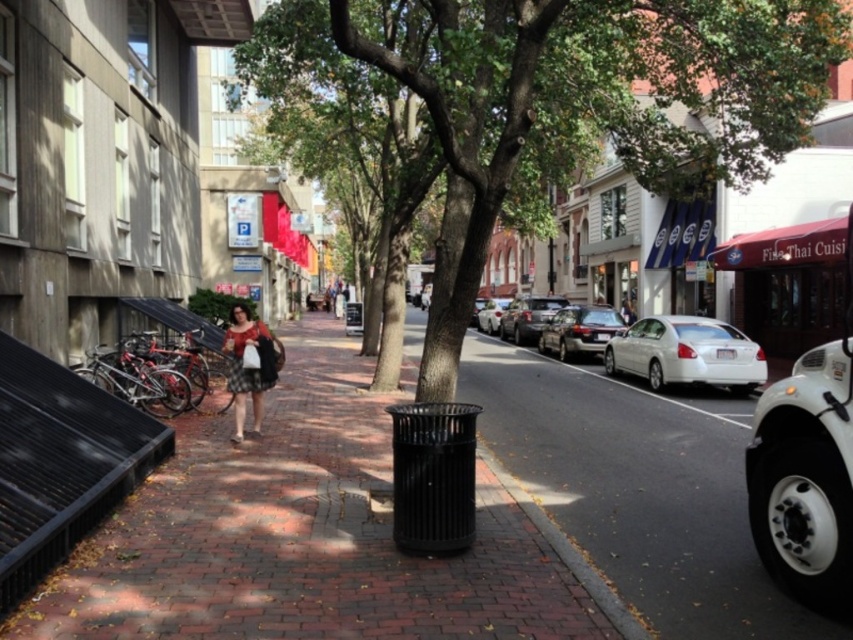
Question: Does green leafy tree at center appear on the right side of white glossy sedan at center-right?

Choices:
 (A) no
 (B) yes

Answer: (A)

Question: Does green leafy tree at center appear under shiny black sedan at center?

Choices:
 (A) no
 (B) yes

Answer: (A)

Question: Does black metal trash can at center appear on the left side of green leafy tree at center?

Choices:
 (A) yes
 (B) no

Answer: (A)

Question: Which point is farther to the camera?

Choices:
 (A) white glossy sedan at center-right
 (B) shiny black sedan at center
 (C) black metal trash can at center
 (D) white matte car at center

Answer: (D)

Question: Which object is positioned farthest from the shiny black sedan at center?

Choices:
 (A) shiny silver sedan at center
 (B) white glossy sedan at center-right
 (C) black metal trash can at center

Answer: (C)

Question: Which object appears closest to the camera in this image?

Choices:
 (A) black metal trash can at center
 (B) shiny black sedan at center
 (C) white glossy sedan at center-right

Answer: (A)